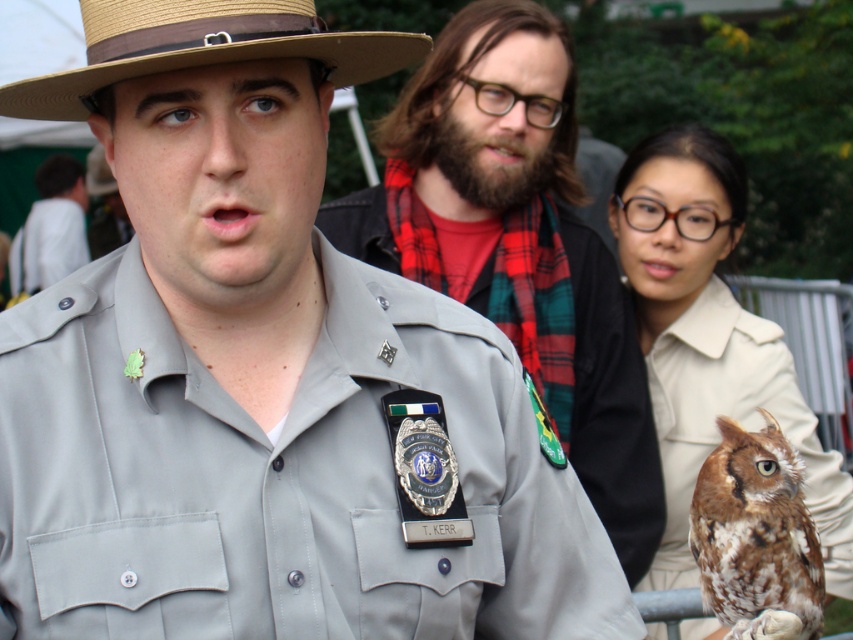
Does point (633, 394) lie in front of point (727, 516)?

No, (633, 394) is further to viewer.

Locate an element on the screen. gray uniform at center is located at coordinates (517, 244).

Is natural straw hat at upper left further to the viewer compared to brown speckled feathers at right?

No, natural straw hat at upper left is in front of brown speckled feathers at right.

In the scene shown: Is natural straw hat at upper left to the left of brown speckled feathers at right from the viewer's perspective?

Correct, you'll find natural straw hat at upper left to the left of brown speckled feathers at right.

Locate an element on the screen. natural straw hat at upper left is located at coordinates (202, 48).

Measure the distance between gray uniform at center and camera.

gray uniform at center is 3.23 meters from camera.

Does gray uniform at center lie behind natural straw hat at upper left?

Yes.

The image size is (853, 640). Identify the location of gray uniform at center. 517,244.

Where is `gray uniform at center`? The height and width of the screenshot is (640, 853). gray uniform at center is located at coordinates (517, 244).